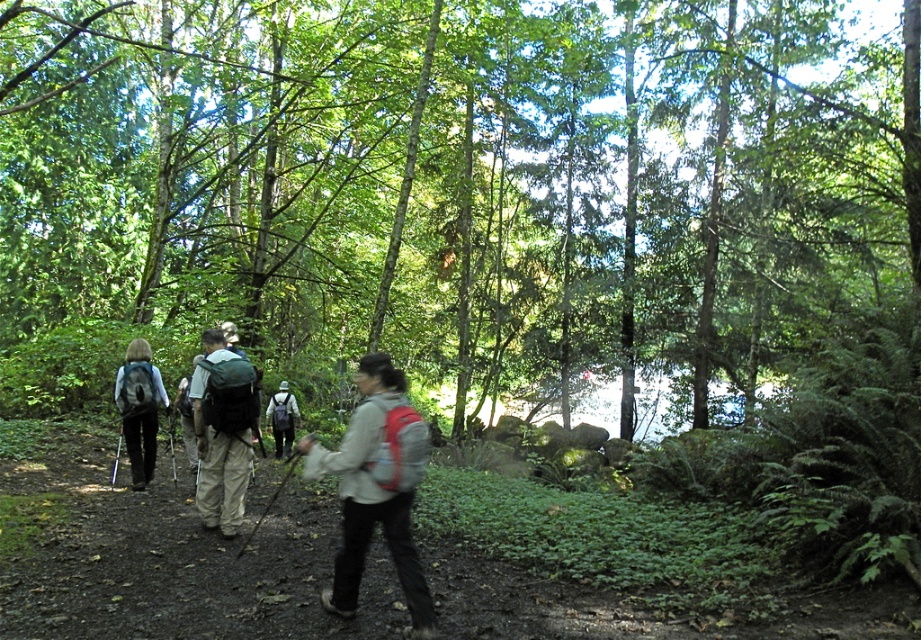
Question: Which point is farther to the camera?

Choices:
 (A) matte gray backpack at center
 (B) matte gray backpack at left

Answer: (A)

Question: In this image, where is matte gray jacket at center located relative to matte green backpack at center?

Choices:
 (A) above
 (B) below

Answer: (B)

Question: Among these objects, which one is farthest from the camera?

Choices:
 (A) matte gray backpack at center
 (B) matte gray jacket at center
 (C) matte gray backpack at left

Answer: (A)

Question: Is the position of matte green backpack at center less distant than that of matte gray backpack at center?

Choices:
 (A) yes
 (B) no

Answer: (A)

Question: Can you confirm if matte gray jacket at center is wider than matte gray backpack at center?

Choices:
 (A) no
 (B) yes

Answer: (B)

Question: Which point is farther to the camera?

Choices:
 (A) (165, 404)
 (B) (283, 422)
 (C) (27, 100)
 (D) (333, 611)

Answer: (C)